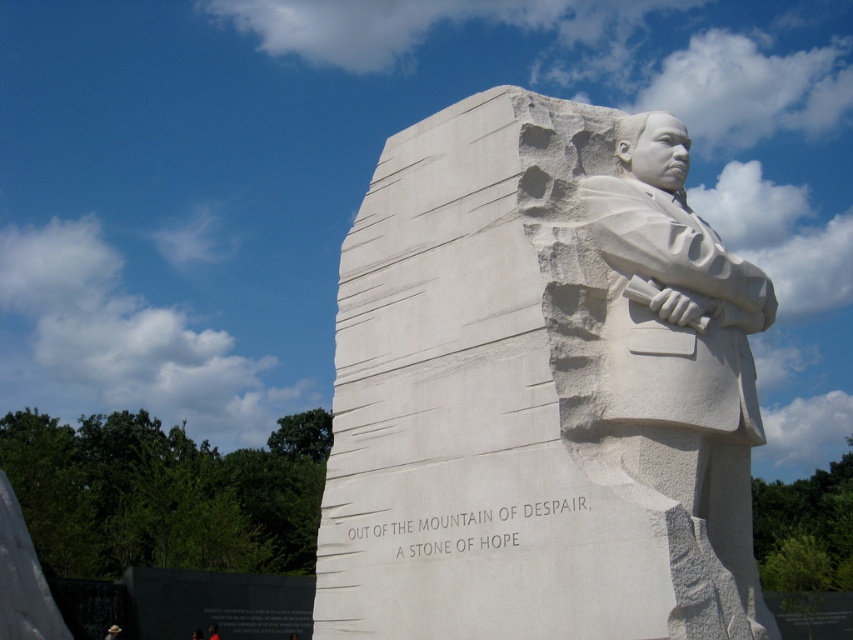
Does white stone statue at center have a lesser width compared to white stone statue at right?

Incorrect, white stone statue at center's width is not less than white stone statue at right's.

Which is more to the left, white stone statue at center or white stone statue at right?

Positioned to the left is white stone statue at center.

Locate an element on the screen. This screenshot has width=853, height=640. white stone statue at center is located at coordinates (540, 388).